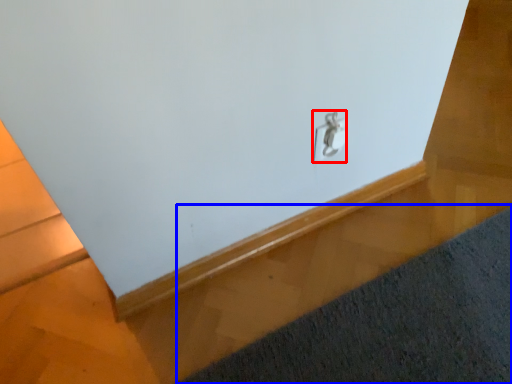
Question: Among these objects, which one is farthest to the camera, lock (highlighted by a red box) or mat (highlighted by a blue box)?

Choices:
 (A) lock
 (B) mat

Answer: (A)